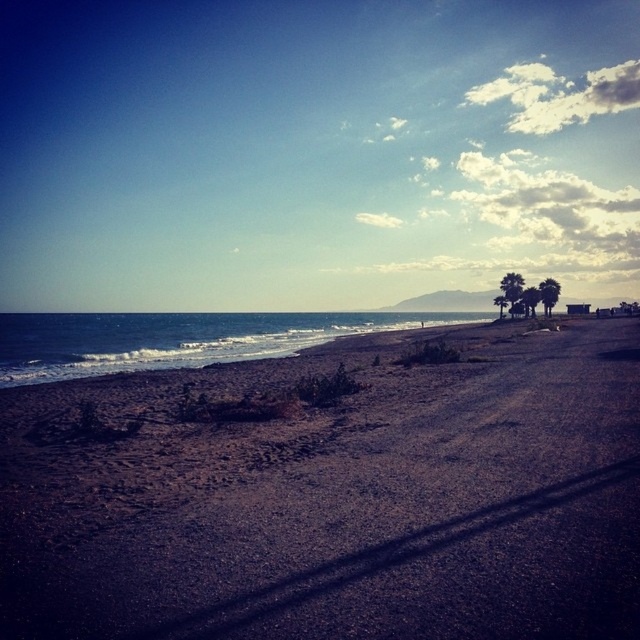
You are standing on the beach and notice the dark brown gravel at lower left and the blue water at lower left. Which of these two objects is positioned closer to the ground?

The dark brown gravel at lower left is positioned closer to the ground as it is below the blue water at lower left.

You are standing on the beach and see the dark brown gravel at lower left marked by point (333, 496). Where is this gravel located relative to the palm trees and the small building in the background?

The dark brown gravel at lower left marked by point (333, 496) is located at the lower left of the image, which is closer to the foreground compared to the palm trees and the small building in the background.

You are a construction worker needing to transport materials from the dark brown gravel at lower left to the blue water at lower left. The truck you have can carry a maximum load of 500 kg and requires a path at least 5 meters wide. Can you safely move the gravel to the water using the available space between them?

The distance between the dark brown gravel at lower left and the blue water at lower left is 61.69 meters. However, the question mentions the truck requires a path at least 5 meters wide. Since the provided information does not specify the width of the path between them, it is impossible to determine if the truck can safely navigate the route based solely on the distance given.